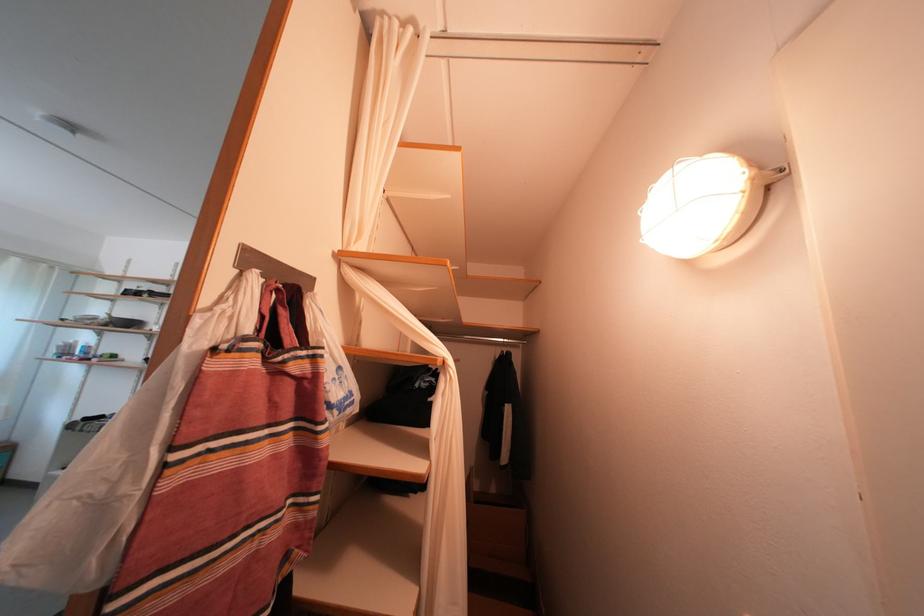
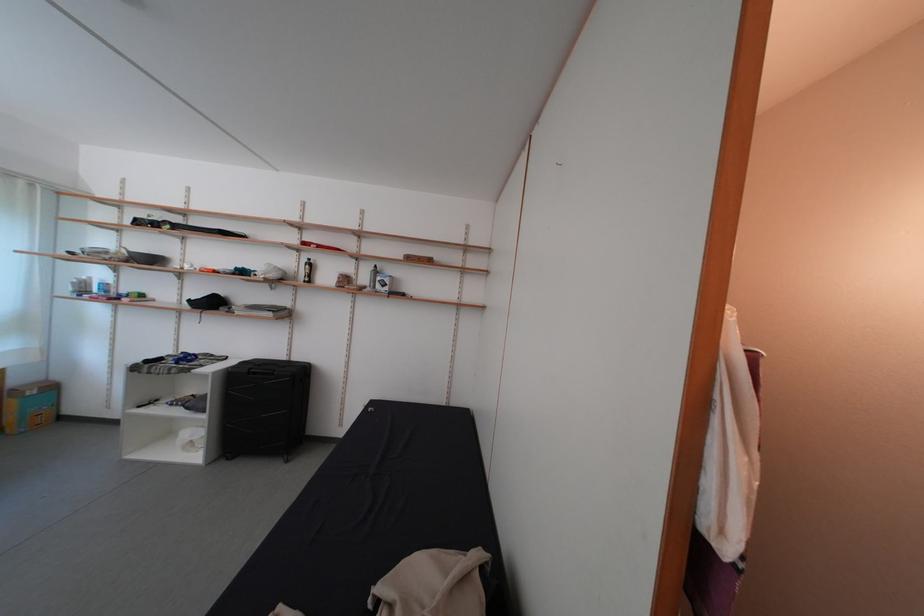
Question: The first image is from the beginning of the video and the second image is from the end. How did the camera likely rotate when shooting the video?

Choices:
 (A) Left
 (B) Right
 (C) Up
 (D) Down

Answer: (D)